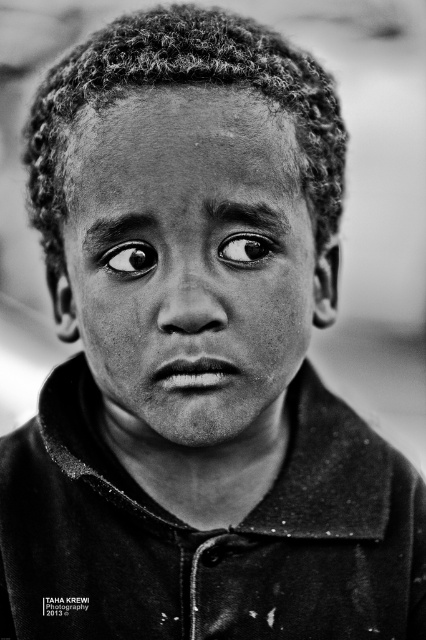
Question: Which point is farther to the camera?

Choices:
 (A) black matte eye at center
 (B) smooth skin face at center

Answer: (A)

Question: Does black matte eye at upper center lie in front of black matte eye at center?

Choices:
 (A) yes
 (B) no

Answer: (A)

Question: Among these objects, which one is farthest from the camera?

Choices:
 (A) black matte eye at center
 (B) black matte eye at upper center
 (C) smooth skin face at center

Answer: (A)

Question: Does black matte eye at upper center appear on the right side of black matte eye at center?

Choices:
 (A) yes
 (B) no

Answer: (A)

Question: Which point appears closest to the camera in this image?

Choices:
 (A) pyautogui.click(x=224, y=252)
 (B) pyautogui.click(x=135, y=276)
 (C) pyautogui.click(x=138, y=246)

Answer: (B)

Question: Is black matte eye at upper center smaller than black matte eye at center?

Choices:
 (A) yes
 (B) no

Answer: (B)